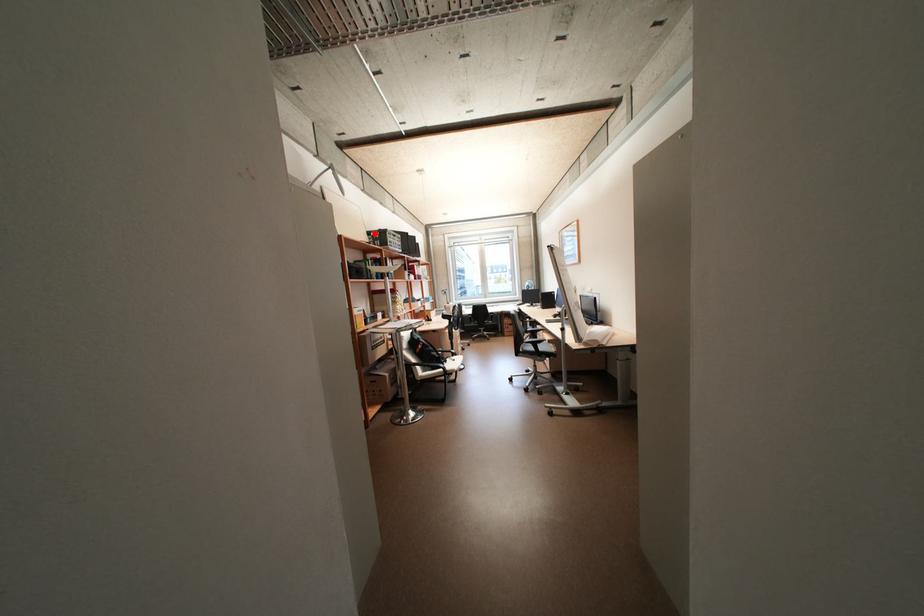
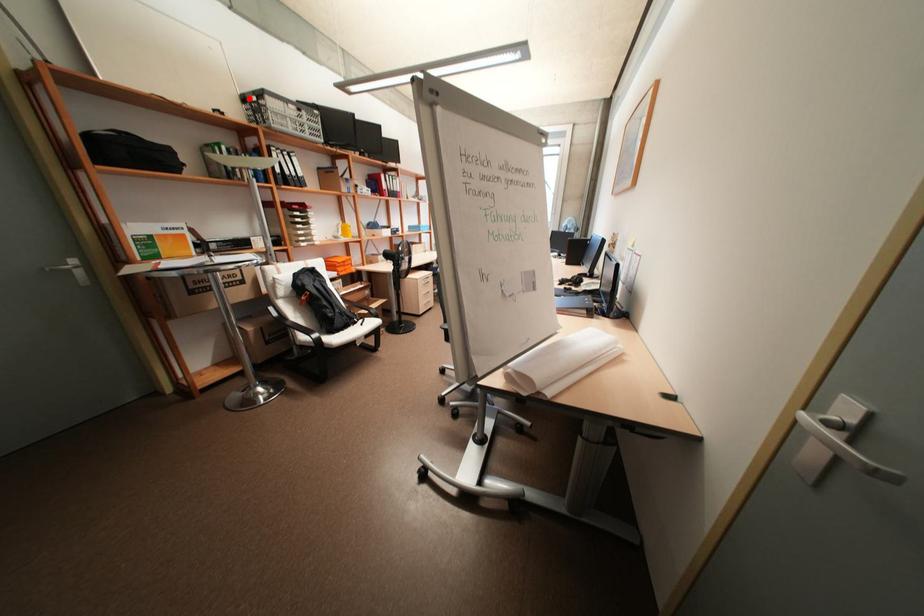
I am providing you with two images of the same scene from different viewpoints. A red point is marked on the first image and another point is marked on the second image. Is the red point in image1 aligned with the point shown in image2?

Yes